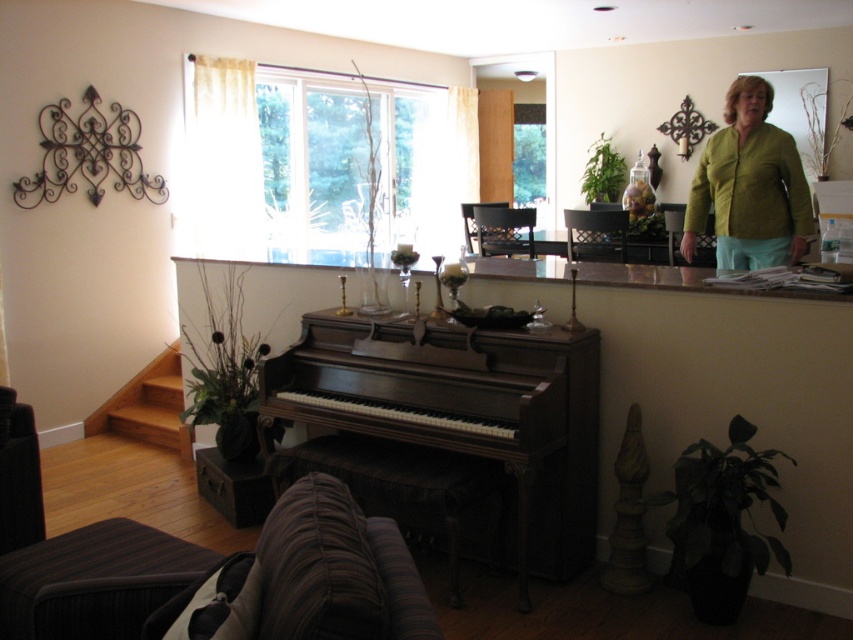
Question: Which object is positioned farthest from the dark wood piano at center?

Choices:
 (A) green textured blouse at upper right
 (B) brown leather stool at lower center

Answer: (A)

Question: Does dark wood piano at center lie behind brown leather stool at lower center?

Choices:
 (A) yes
 (B) no

Answer: (B)

Question: Which point appears farthest from the camera in this image?

Choices:
 (A) (728, 234)
 (B) (450, 499)
 (C) (160, 536)

Answer: (A)

Question: Is dark wood piano at center to the left of brown leather stool at lower center from the viewer's perspective?

Choices:
 (A) no
 (B) yes

Answer: (A)

Question: Is the position of dark wood piano at center more distant than that of brown leather stool at lower center?

Choices:
 (A) yes
 (B) no

Answer: (B)

Question: Which point is farther from the camera taking this photo?

Choices:
 (A) (74, 534)
 (B) (378, 484)

Answer: (B)